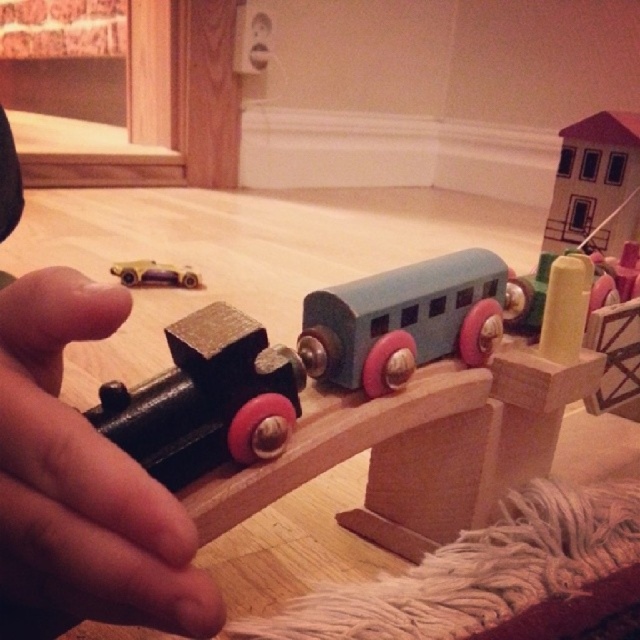
You are a parent trying to place a new toy on the play area. The new toy requires 1 meter of space between the brushed metal train at center and metallic gold car at left. Do you think there is enough space?

The brushed metal train at center is 85.00 centimeters away from metallic gold car at left. Since 85 centimeters is less than 1 meter, there is not enough space to place the new toy requiring 1 meter between them.

You are a toy collector who wants to take a photo of the black matte hand at center. If your camera can focus on objects within 20 centimeters, will you need to adjust your position to capture it clearly?

The black matte hand at center is 21.42 centimeters away from the camera, which is beyond the 20 centimeter focus range. Therefore, you need to move closer to ensure the black matte hand at center is within the camera focus range.

You are a child playing with the toys and want to pick up the closest toy to you. Which one should you choose between the brushed metal train at center and the metallic gold car at left?

The brushed metal train at center is closer to the viewer, so you should pick up the brushed metal train at center first.